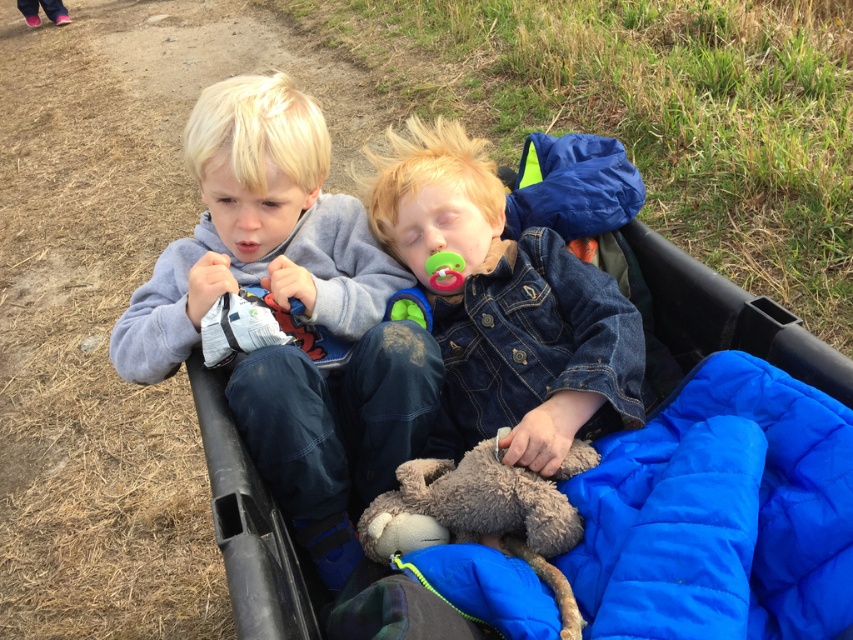
You are a parent trying to retrieve the rubber pacifier at center and the green plush toy at center from the black plastic container. Which object will you need to reach for first due to its position?

The rubber pacifier at center is further to the viewer than the green plush toy at center, so you should reach for the rubber pacifier at center first.

In the scene shown: You are a photographer trying to capture a candid shot of the two children in the black plastic container. You notice a specific point marked at coordinates (287,308). Which child is this point indicating?

The point marked at coordinates (287,308) indicates the gray fleece hoodie at left.

The two children are sitting in a black plastic container. The child wearing the gray fleece hoodie at left is holding a small white object. How far apart are the two children?

The two children are 3.49 feet apart.